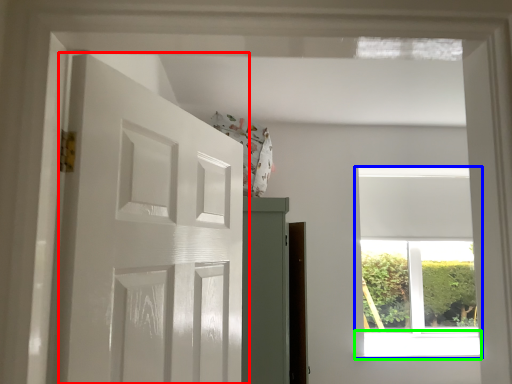
Question: Estimate the real-world distances between objects in this image. Which object is closer to door (highlighted by a red box), window (highlighted by a blue box) or window sill (highlighted by a green box)?

Choices:
 (A) window
 (B) window sill

Answer: (B)